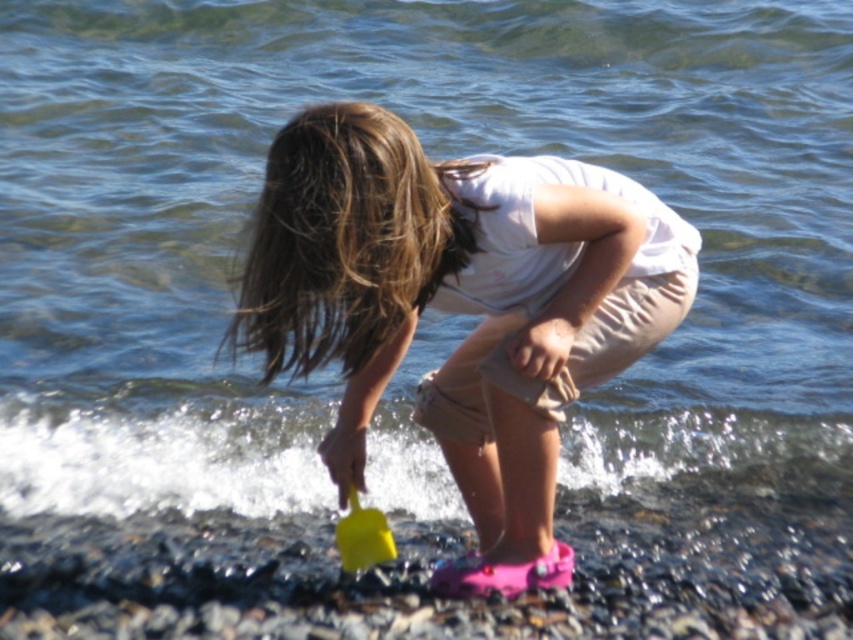
Is point (509, 554) closer to viewer compared to point (352, 541)?

No.

At what (x,y) coordinates should I click in order to perform the action: click on white cotton shirt at center. Please return your answer as a coordinate pair (x, y). This screenshot has height=640, width=853. Looking at the image, I should click on (460, 307).